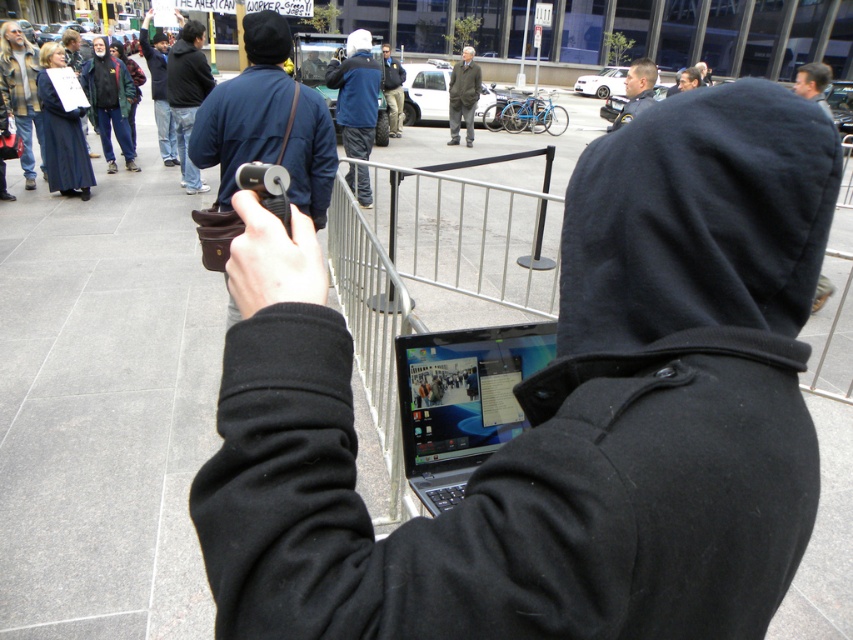
You are a photographer at the scene. You need to determine which clothing item, the gray wool coat at center or the dark blue jacket at center, is wider to decide which one to include in your closeup shot. Which one is wider?

The gray wool coat at center is wider than the dark blue jacket at center, so you should choose the gray wool coat at center for your closeup shot to capture the wider item.

You are a photographer trying to capture the crowd behind the barricade. You have two items at your disposal, the dark blue hoodie at center and the dark blue jacket at center. Which item is positioned lower on your body to help you get a better angle for the shot?

The dark blue hoodie at center is located below the dark blue jacket at center, so it is positioned lower on your body and can help you get a better angle for the shot.